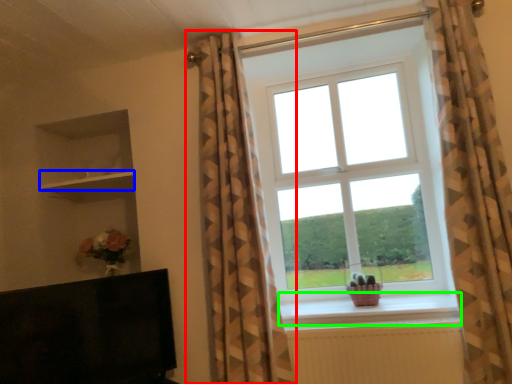
Question: Estimate the real-world distances between objects in this image. Which object is farther from curtain (highlighted by a red box), shelf (highlighted by a blue box) or window sill (highlighted by a green box)?

Choices:
 (A) shelf
 (B) window sill

Answer: (A)